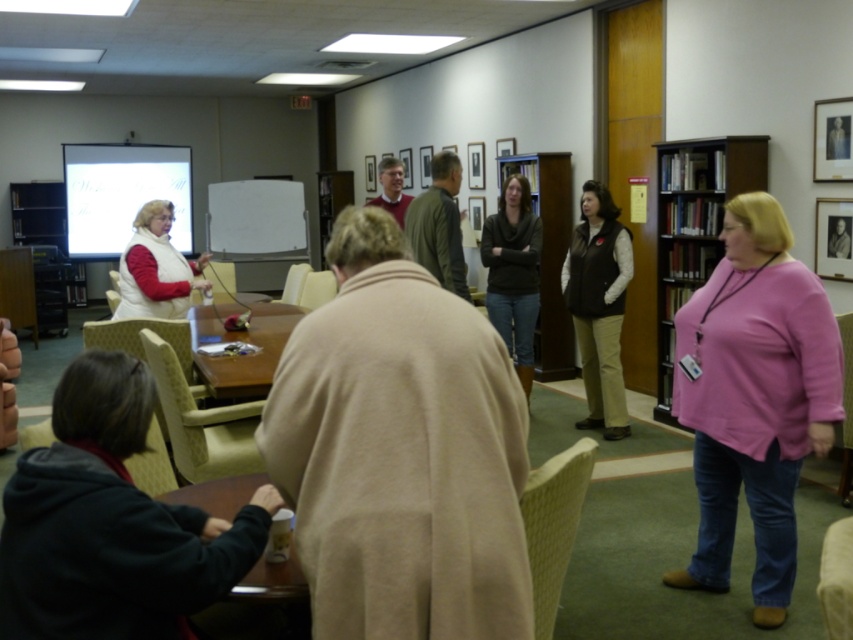
You are organizing a meeting in this room and need to seat two people at the table. You have a light beige fabric chair at center and a light brown fabric chair at center. Which chair provides more seating space for a person?

The light beige fabric chair at center provides more seating space because its width surpasses that of the light brown fabric chair at center.